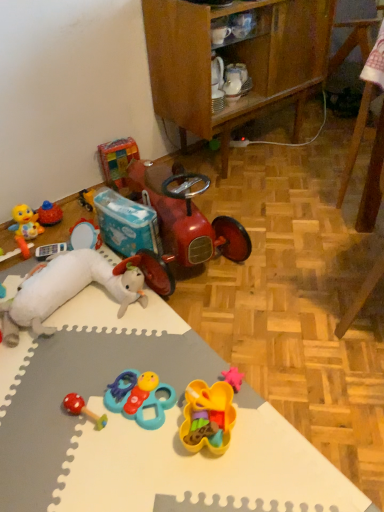
Locate an element on the screen. This screenshot has width=384, height=512. free spot above teal plastic toy at center, which is counted as the 3th toy, starting from the front (from a real-world perspective) is located at coordinates (140, 385).